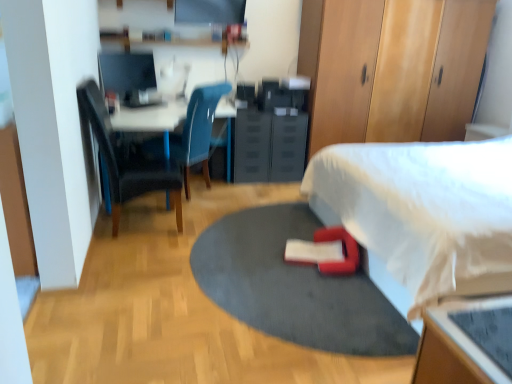
Question: Would you say matte black monitor at upper left is a long distance from red rubber yoga mat at center?

Choices:
 (A) yes
 (B) no

Answer: (A)

Question: Would you say red rubber yoga mat at center is part of matte black monitor at upper left's contents?

Choices:
 (A) yes
 (B) no

Answer: (B)

Question: From a real-world perspective, does matte black monitor at upper left sit lower than red rubber yoga mat at center?

Choices:
 (A) no
 (B) yes

Answer: (A)

Question: Can you confirm if matte black monitor at upper left is positioned to the right of red rubber yoga mat at center?

Choices:
 (A) no
 (B) yes

Answer: (A)

Question: From the image's perspective, is matte black monitor at upper left on top of red rubber yoga mat at center?

Choices:
 (A) no
 (B) yes

Answer: (B)

Question: Is matte blue chair at center, which ranks as the second chair in front-to-back order, in front of or behind matte black monitor at upper left in the image?

Choices:
 (A) behind
 (B) front

Answer: (B)

Question: Considering the positions of matte blue chair at center, positioned as the 1th chair in back-to-front order, and matte black monitor at upper left in the image, is matte blue chair at center, positioned as the 1th chair in back-to-front order, wider or thinner than matte black monitor at upper left?

Choices:
 (A) wide
 (B) thin

Answer: (A)

Question: Is point (175, 135) closer or farther from the camera than point (144, 61)?

Choices:
 (A) farther
 (B) closer

Answer: (B)

Question: Which is correct: matte blue chair at center, positioned as the 1th chair in back-to-front order, is inside matte black monitor at upper left, or outside of it?

Choices:
 (A) inside
 (B) outside

Answer: (B)

Question: From the image's perspective, relative to black plastic drawer at center, is red fabric bean bag chair at lower center above or below?

Choices:
 (A) below
 (B) above

Answer: (A)

Question: In terms of width, does red fabric bean bag chair at lower center look wider or thinner when compared to black plastic drawer at center?

Choices:
 (A) thin
 (B) wide

Answer: (A)

Question: Based on their positions, is red fabric bean bag chair at lower center located to the left or right of black plastic drawer at center?

Choices:
 (A) left
 (B) right

Answer: (B)

Question: From a real-world perspective, is red fabric bean bag chair at lower center positioned above or below black plastic drawer at center?

Choices:
 (A) above
 (B) below

Answer: (B)

Question: Is red fabric bean bag chair at lower center bigger or smaller than red rubber yoga mat at center?

Choices:
 (A) big
 (B) small

Answer: (B)

Question: Considering the positions of red fabric bean bag chair at lower center and red rubber yoga mat at center in the image, is red fabric bean bag chair at lower center taller or shorter than red rubber yoga mat at center?

Choices:
 (A) tall
 (B) short

Answer: (A)